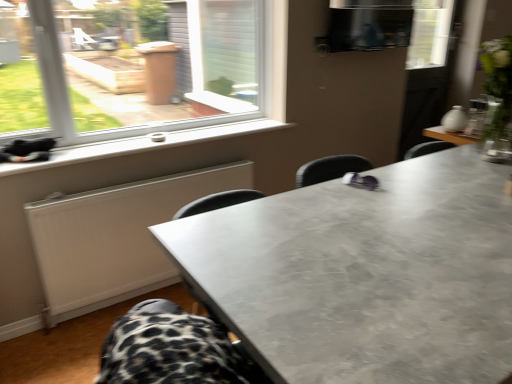
Question: Is white matte radiator at lower left beside matte gray table at center?

Choices:
 (A) no
 (B) yes

Answer: (A)

Question: Considering the relative sizes of white matte radiator at lower left and matte gray table at center in the image provided, is white matte radiator at lower left taller than matte gray table at center?

Choices:
 (A) yes
 (B) no

Answer: (B)

Question: Is white matte radiator at lower left aimed at matte gray table at center?

Choices:
 (A) no
 (B) yes

Answer: (B)

Question: Is white matte radiator at lower left facing away from matte gray table at center?

Choices:
 (A) no
 (B) yes

Answer: (A)

Question: Is matte gray table at center inside white matte radiator at lower left?

Choices:
 (A) no
 (B) yes

Answer: (A)

Question: Does white matte radiator at lower left appear on the right side of matte gray table at center?

Choices:
 (A) no
 (B) yes

Answer: (A)

Question: Would you say white plastic window sill at lower left contains white matte radiator at lower left?

Choices:
 (A) no
 (B) yes

Answer: (A)

Question: Is white plastic window sill at lower left oriented towards white matte radiator at lower left?

Choices:
 (A) yes
 (B) no

Answer: (B)

Question: Is the depth of white plastic window sill at lower left greater than that of white matte radiator at lower left?

Choices:
 (A) no
 (B) yes

Answer: (A)

Question: From a real-world perspective, is white plastic window sill at lower left located beneath white matte radiator at lower left?

Choices:
 (A) no
 (B) yes

Answer: (A)

Question: Can you confirm if white plastic window sill at lower left is thinner than white matte radiator at lower left?

Choices:
 (A) yes
 (B) no

Answer: (B)

Question: Considering the relative sizes of white plastic window sill at lower left and white matte radiator at lower left in the image provided, is white plastic window sill at lower left shorter than white matte radiator at lower left?

Choices:
 (A) yes
 (B) no

Answer: (A)

Question: Is white plastic window sill at lower left inside matte gray table at center?

Choices:
 (A) no
 (B) yes

Answer: (A)